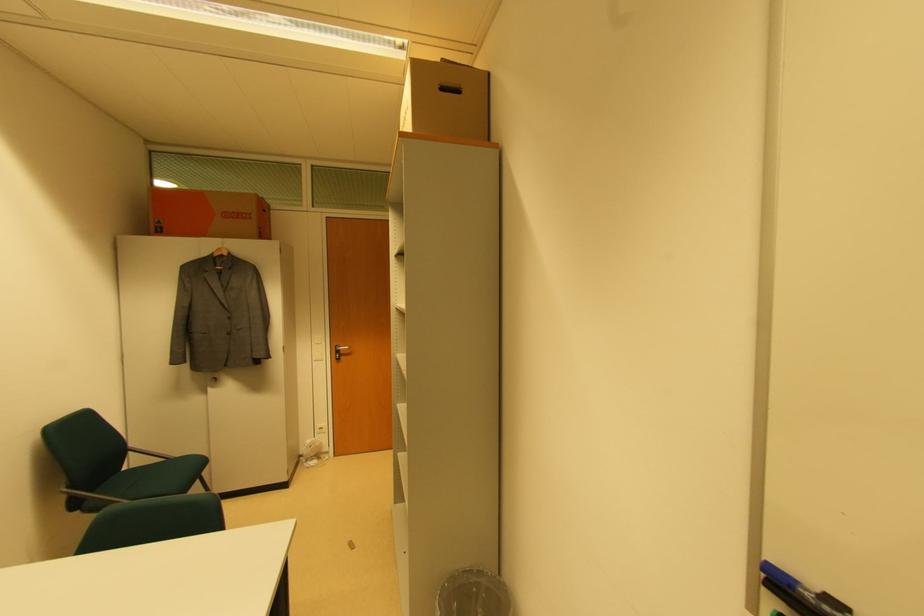
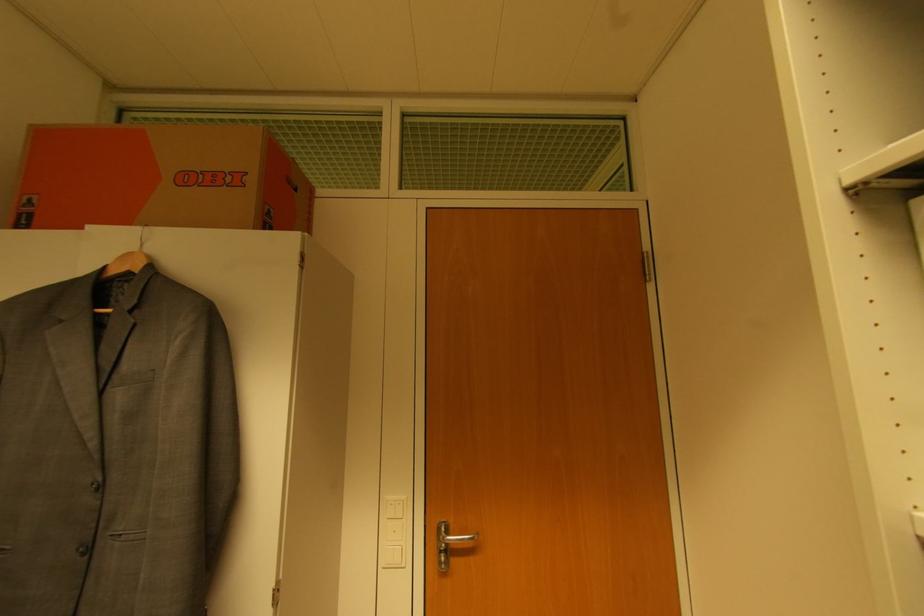
The point at (x=341, y=350) is marked in the first image. Where is the corresponding point in the second image?

(448, 533)